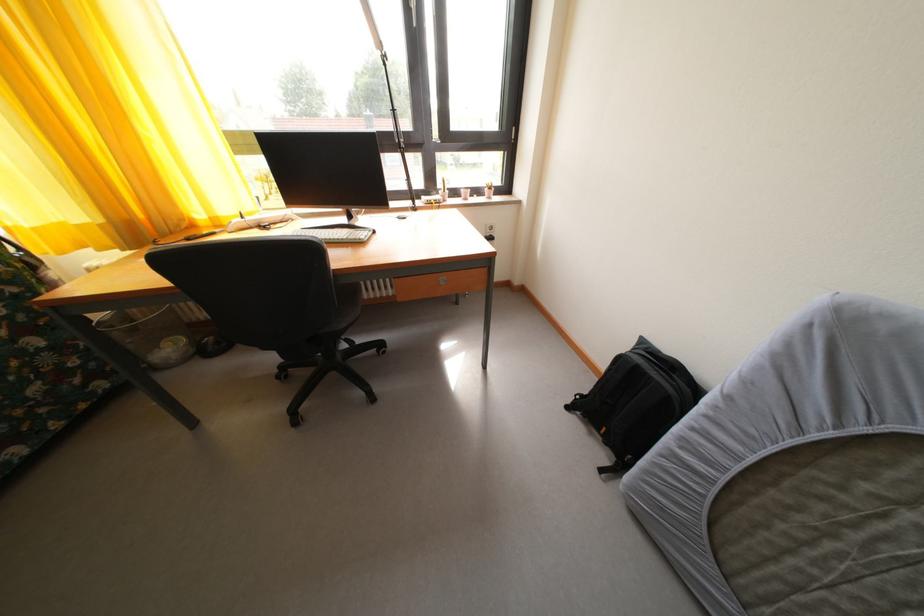
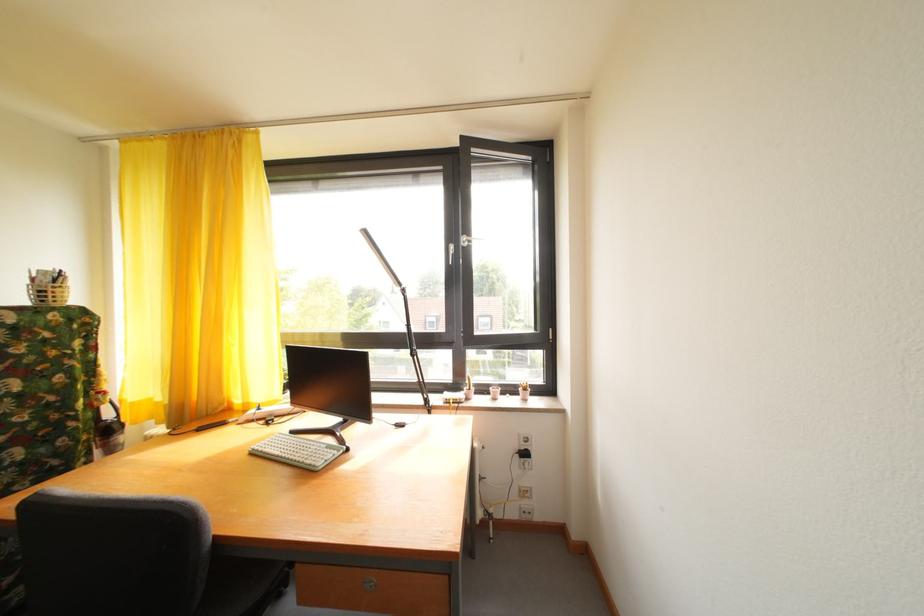
Locate, in the second image, the point that corresponds to point 485,198 in the first image.

(520, 395)